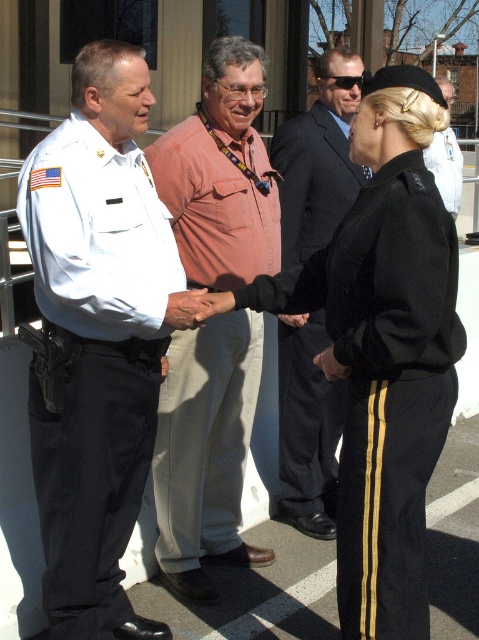
Question: Does white uniform at left have a greater width compared to pink cotton shirt at center?

Choices:
 (A) yes
 (B) no

Answer: (B)

Question: Which object is positioned closest to the pink cotton shirt at center?

Choices:
 (A) black uniform at center
 (B) dark gray suit at center

Answer: (B)

Question: Where is pink cotton shirt at center located in relation to dark gray suit at center in the image?

Choices:
 (A) left
 (B) right

Answer: (A)

Question: Considering the real-world distances, which object is closest to the dark gray suit at center?

Choices:
 (A) pink cotton shirt at center
 (B) black uniform at center
 (C) white uniform at left

Answer: (A)

Question: Which point is closer to the camera taking this photo?

Choices:
 (A) (249, 131)
 (B) (34, 436)

Answer: (B)

Question: Observing the image, what is the correct spatial positioning of black uniform at center in reference to dark gray suit at center?

Choices:
 (A) left
 (B) right

Answer: (A)